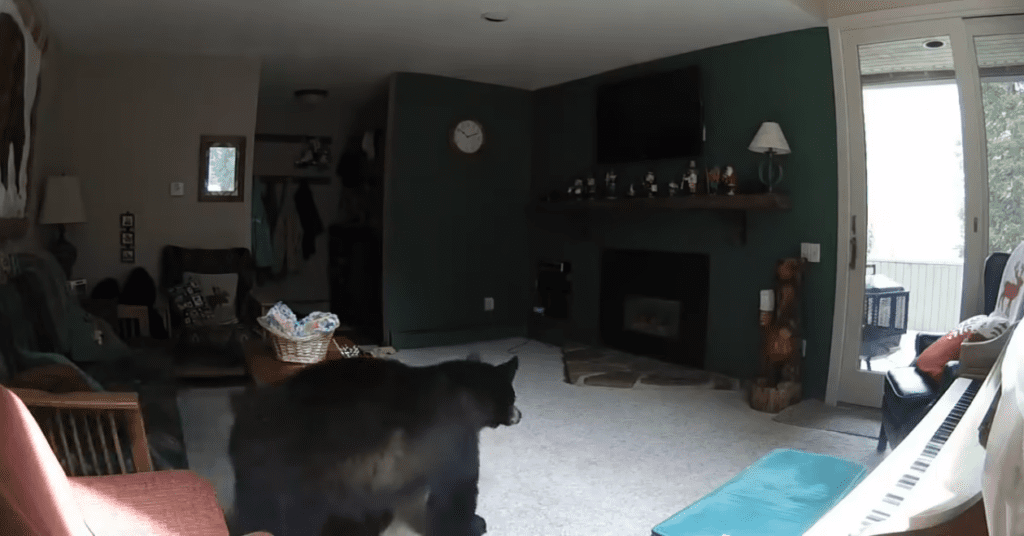
This screenshot has width=1024, height=536. Find the location of `pink chair`. pink chair is located at coordinates (158, 490).